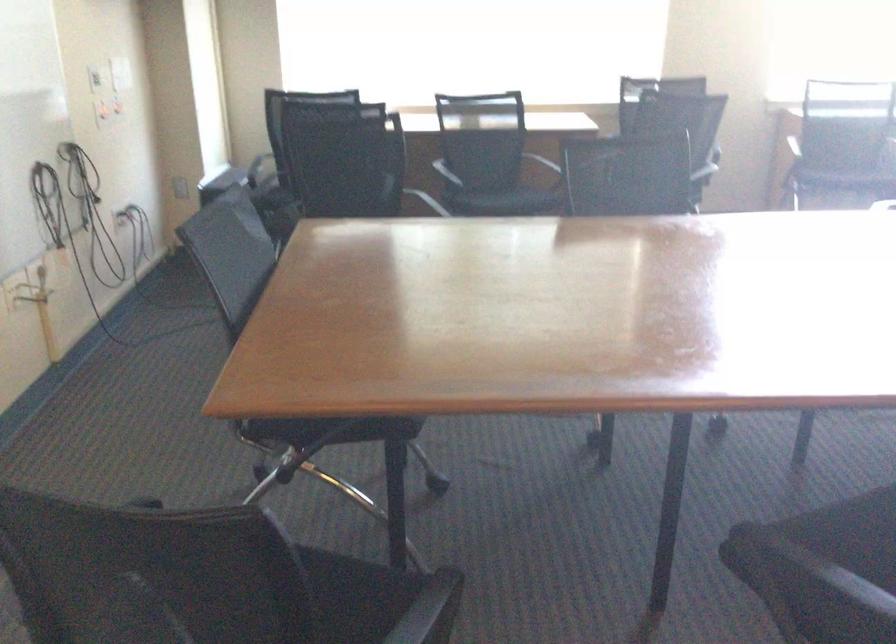
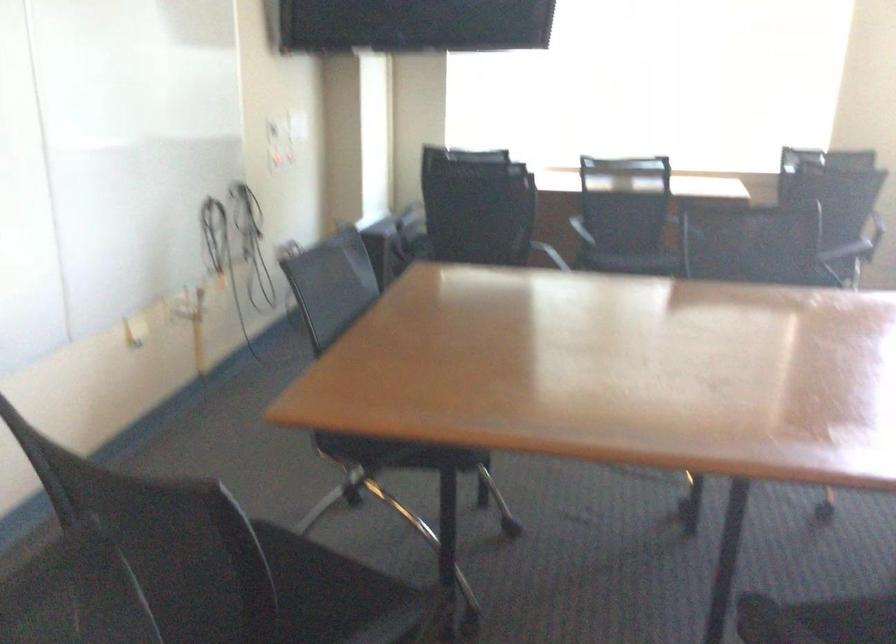
The point at (500, 200) is marked in the first image. Where is the corresponding point in the second image?

(633, 260)